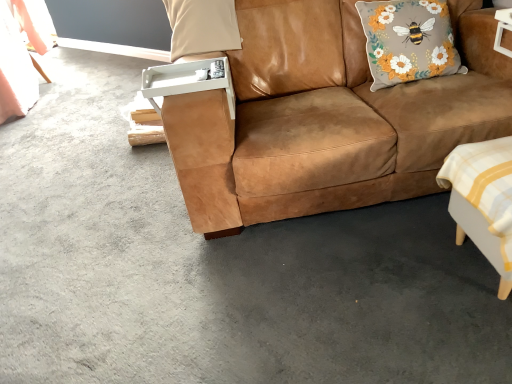
Question: Which direction should I rotate to face beige fabric pillow at upper center, which ranks as the second pillow in right-to-left order, — up or down?

Choices:
 (A) up
 (B) down

Answer: (A)

Question: Can you confirm if beige fabric pillow at upper center, which ranks as the second pillow in right-to-left order, is shorter than white checkered fabric swivel chair at lower right?

Choices:
 (A) yes
 (B) no

Answer: (B)

Question: Is beige fabric pillow at upper center, which ranks as the second pillow in right-to-left order, at the left side of white checkered fabric swivel chair at lower right?

Choices:
 (A) yes
 (B) no

Answer: (A)

Question: Is beige fabric pillow at upper center, which ranks as the second pillow in right-to-left order, closer to camera compared to white checkered fabric swivel chair at lower right?

Choices:
 (A) yes
 (B) no

Answer: (B)

Question: From a real-world perspective, is beige fabric pillow at upper center, the 1th pillow positioned from the left, physically above white checkered fabric swivel chair at lower right?

Choices:
 (A) yes
 (B) no

Answer: (A)

Question: Is beige fabric pillow at upper center, which ranks as the second pillow in right-to-left order, aimed at white checkered fabric swivel chair at lower right?

Choices:
 (A) no
 (B) yes

Answer: (A)

Question: Can you confirm if beige fabric pillow at upper center, the 1th pillow positioned from the left, is taller than white checkered fabric swivel chair at lower right?

Choices:
 (A) no
 (B) yes

Answer: (B)

Question: Is suede brown couch at center thinner than beige fabric pillow at upper center, the 1th pillow positioned from the left?

Choices:
 (A) no
 (B) yes

Answer: (A)

Question: Is suede brown couch at center turned away from beige fabric pillow at upper center, which ranks as the second pillow in right-to-left order?

Choices:
 (A) no
 (B) yes

Answer: (B)

Question: Is suede brown couch at center far away from beige fabric pillow at upper center, the 1th pillow positioned from the left?

Choices:
 (A) no
 (B) yes

Answer: (A)

Question: Considering the relative sizes of suede brown couch at center and beige fabric pillow at upper center, the 1th pillow positioned from the left, in the image provided, is suede brown couch at center taller than beige fabric pillow at upper center, the 1th pillow positioned from the left,?

Choices:
 (A) yes
 (B) no

Answer: (A)

Question: Does suede brown couch at center appear on the right side of beige fabric pillow at upper center, the 1th pillow positioned from the left?

Choices:
 (A) no
 (B) yes

Answer: (B)

Question: From a real-world perspective, does suede brown couch at center stand above beige fabric pillow at upper center, the 1th pillow positioned from the left?

Choices:
 (A) yes
 (B) no

Answer: (B)

Question: From the image's perspective, is floral fabric cushion with bee design at upper right, the 2th pillow positioned from the left, located beneath white checkered fabric swivel chair at lower right?

Choices:
 (A) yes
 (B) no

Answer: (B)